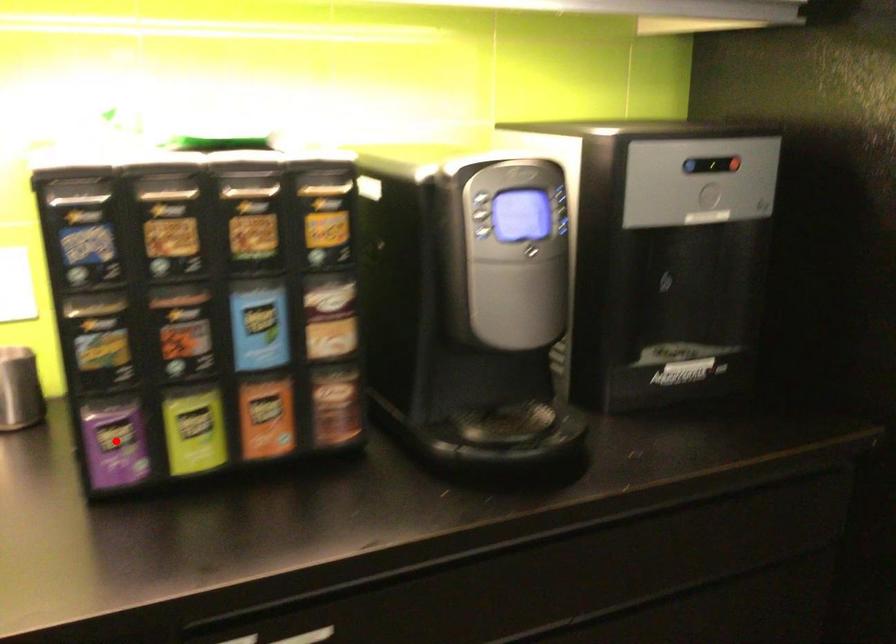
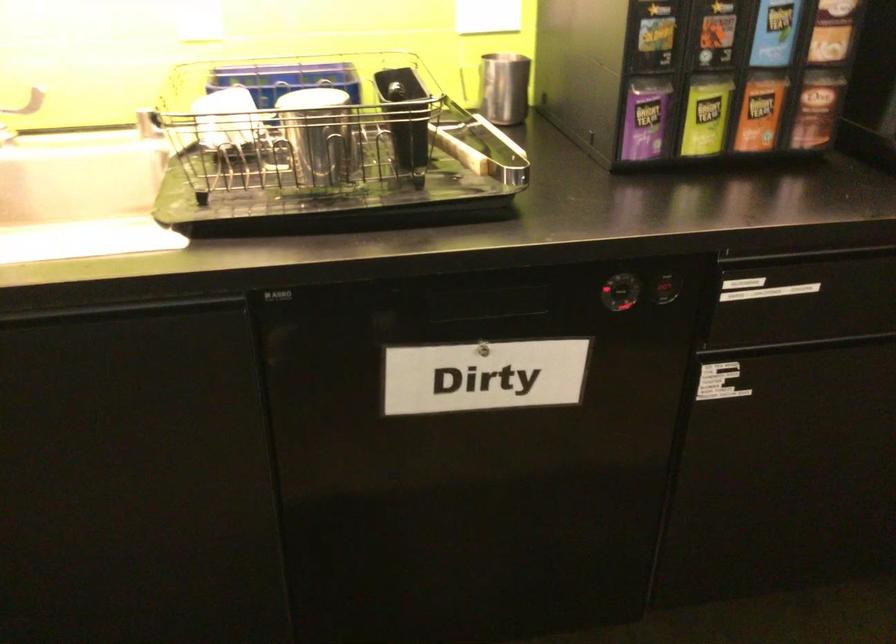
Question: I am providing you with two images of the same scene from different viewpoints. A red point is shown in image1. For the corresponding object point in image2, is it positioned nearer or farther from the camera?

Choices:
 (A) Nearer
 (B) Farther

Answer: (B)